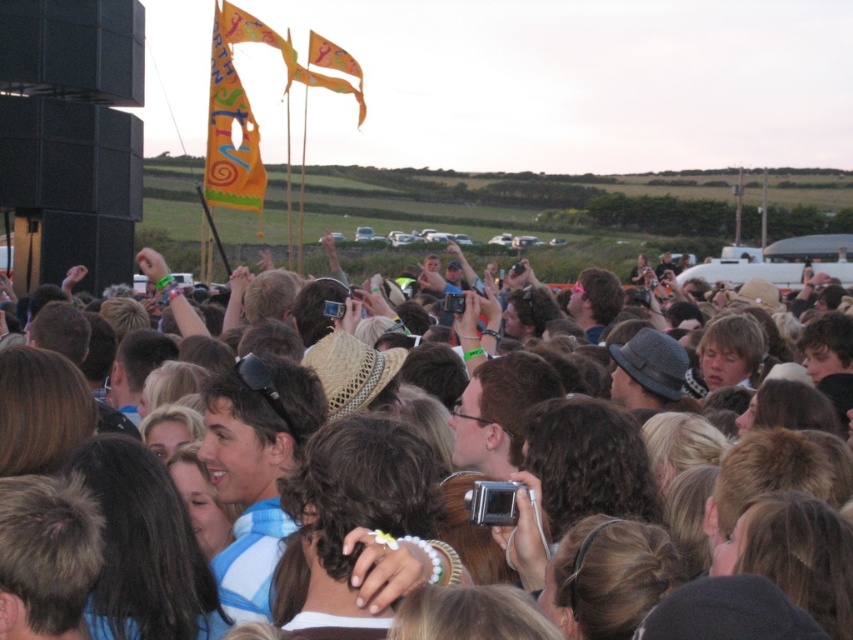
Question: Which point is farther to the camera?

Choices:
 (A) (410, 544)
 (B) (218, 189)

Answer: (B)

Question: Which object appears farthest from the camera in this image?

Choices:
 (A) brown hair at center
 (B) orange fabric flag at upper left

Answer: (B)

Question: Can you confirm if brown hair at center is wider than orange fabric flag at upper left?

Choices:
 (A) yes
 (B) no

Answer: (A)

Question: Is brown hair at center to the left of orange fabric flag at upper left from the viewer's perspective?

Choices:
 (A) no
 (B) yes

Answer: (A)

Question: Does brown hair at center appear on the left side of orange fabric flag at upper left?

Choices:
 (A) no
 (B) yes

Answer: (A)